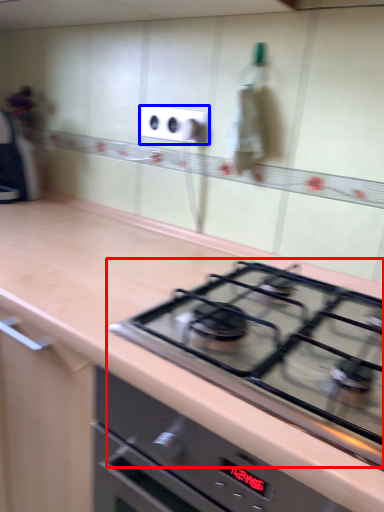
Question: Which point is closer to the camera, gas stove (highlighted by a red box) or electric outlet (highlighted by a blue box)?

Choices:
 (A) gas stove
 (B) electric outlet

Answer: (A)